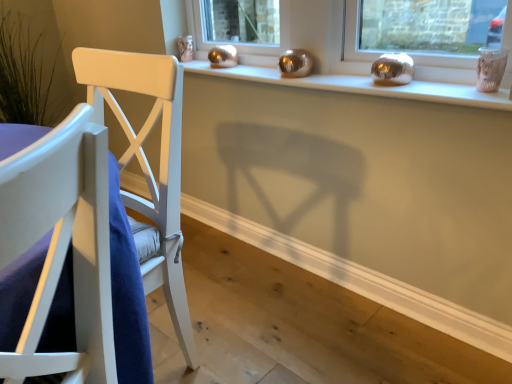
Question: Considering the relative positions of white wood chair at left and satin gold ornaments at upper center in the image provided, is white wood chair at left to the left or to the right of satin gold ornaments at upper center?

Choices:
 (A) right
 (B) left

Answer: (B)

Question: In terms of width, does white wood chair at left look wider or thinner when compared to satin gold ornaments at upper center?

Choices:
 (A) thin
 (B) wide

Answer: (B)

Question: From the image's perspective, is white wood chair at left positioned above or below satin gold ornaments at upper center?

Choices:
 (A) above
 (B) below

Answer: (B)

Question: From their relative heights in the image, would you say satin gold ornaments at upper center is taller or shorter than white wood chair at left?

Choices:
 (A) tall
 (B) short

Answer: (B)

Question: Is satin gold ornaments at upper center inside or outside of white wood chair at left?

Choices:
 (A) inside
 (B) outside

Answer: (B)

Question: Considering the positions of point (347, 81) and point (49, 253), is point (347, 81) closer or farther from the camera than point (49, 253)?

Choices:
 (A) closer
 (B) farther

Answer: (B)

Question: From a real-world perspective, relative to white wood chair at left, is satin gold ornaments at upper center vertically above or below?

Choices:
 (A) below
 (B) above

Answer: (B)